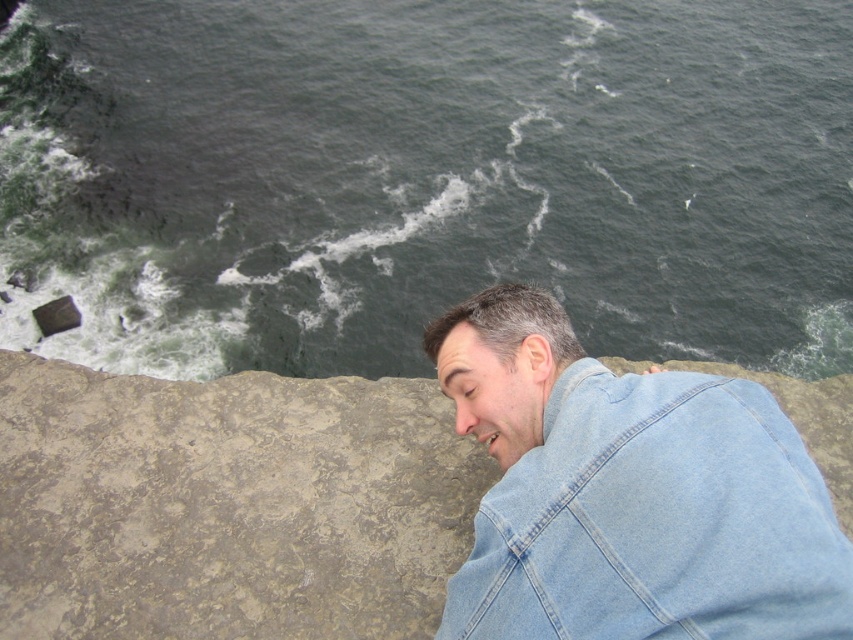
Is dark green water at upper left thinner than gray stone cliff at lower right?

Incorrect, dark green water at upper left's width is not less than gray stone cliff at lower right's.

Between dark green water at upper left and gray stone cliff at lower right, which one is positioned lower?

gray stone cliff at lower right is lower down.

What do you see at coordinates (425, 179) in the screenshot? I see `dark green water at upper left` at bounding box center [425, 179].

This screenshot has width=853, height=640. What are the coordinates of `dark green water at upper left` in the screenshot? It's located at (425, 179).

Who is higher up, dark green water at upper left or denim jacket at lower right?

Positioned higher is dark green water at upper left.

Does dark green water at upper left appear under denim jacket at lower right?

Incorrect, dark green water at upper left is not positioned below denim jacket at lower right.

Who is more distant from viewer, [334,145] or [699,618]?

Point [334,145]

The width and height of the screenshot is (853, 640). In order to click on dark green water at upper left in this screenshot , I will do `click(425, 179)`.

Is gray stone cliff at lower right taller than denim jacket at lower right?

Yes, gray stone cliff at lower right is taller than denim jacket at lower right.

How far apart are gray stone cliff at lower right and denim jacket at lower right?

The distance of gray stone cliff at lower right from denim jacket at lower right is 7.37 feet.

The image size is (853, 640). Find the location of `gray stone cliff at lower right`. gray stone cliff at lower right is located at coordinates (227, 506).

Identify the location of gray stone cliff at lower right. (227, 506).